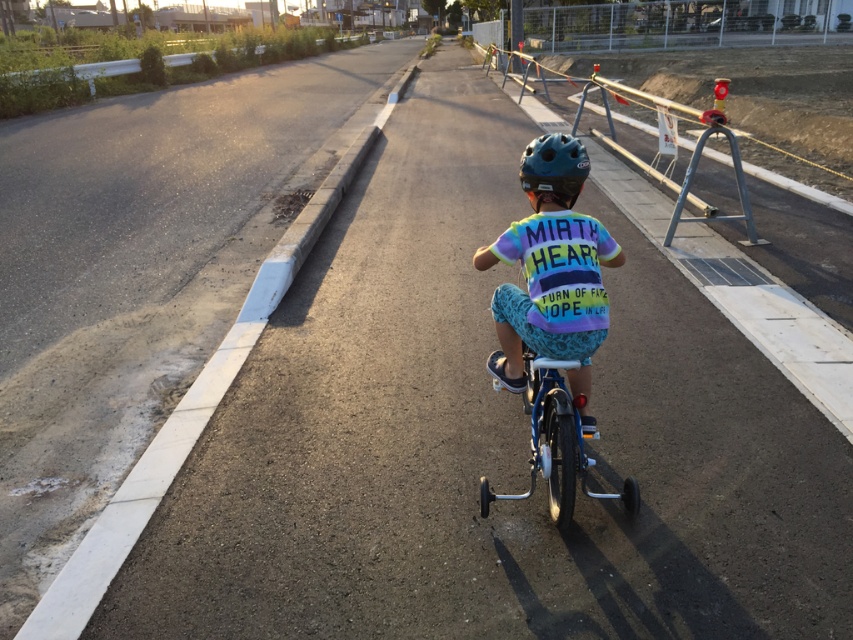
Looking at this image, who is more distant from viewer, (555, 148) or (646, 97)?

Positioned behind is point (646, 97).

Is matte blue helmet at center positioned behind metallic silver rail at upper right?

No, it is not.

Describe the element at coordinates (553, 170) in the screenshot. This screenshot has height=640, width=853. I see `matte blue helmet at center` at that location.

Identify the location of matte blue helmet at center. This screenshot has width=853, height=640. (553, 170).

Looking at this image, is blue metallic bicycle at center further to camera compared to matte blue helmet at center?

No, blue metallic bicycle at center is closer to the viewer.

Can you confirm if blue metallic bicycle at center is thinner than matte blue helmet at center?

No.

This screenshot has width=853, height=640. In order to click on blue metallic bicycle at center in this screenshot , I will do `click(556, 442)`.

Can you confirm if multicolored jersey at center is positioned above matte blue helmet at center?

Actually, multicolored jersey at center is below matte blue helmet at center.

Is multicolored jersey at center shorter than matte blue helmet at center?

No, multicolored jersey at center is not shorter than matte blue helmet at center.

Does point (564, 284) come closer to viewer compared to point (561, 156)?

That is True.

At what (x,y) coordinates should I click in order to perform the action: click on multicolored jersey at center. Please return your answer as a coordinate pair (x, y). Image resolution: width=853 pixels, height=640 pixels. Looking at the image, I should click on (550, 269).